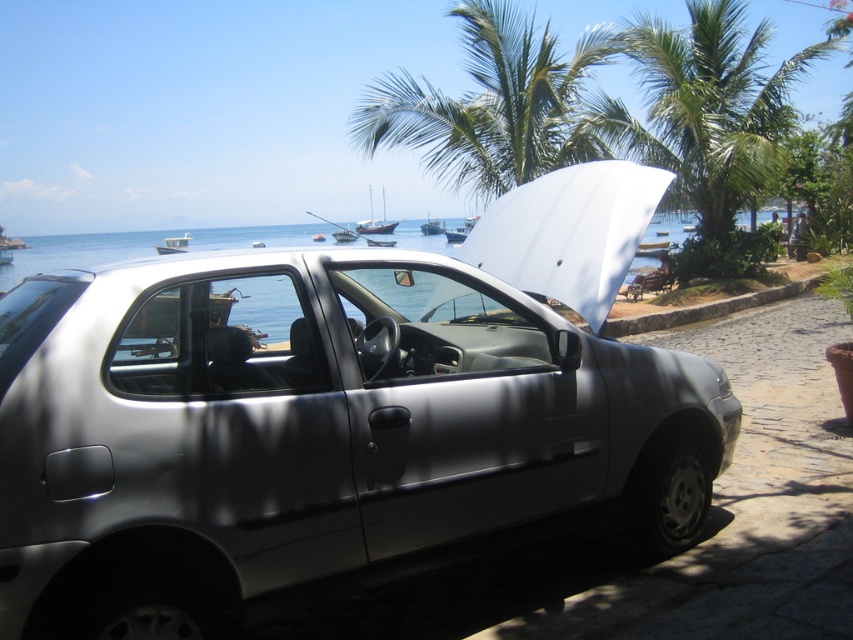
You are a photographer planning to capture a wide shot of the wooden sailboat at center and the green leafy palm tree at upper center. Based on their sizes, which object would likely occupy more of the frame horizontally?

The green leafy palm tree at upper center might be wider than the wooden sailboat at center, so it could occupy more horizontal space in the frame.

You are standing in front of the silver car with the hood open on the cobblestone street. You see two points marked on the car. Which point is closer to you, point (x=329, y=339) or point (x=430, y=220)?

Point (x=329, y=339) is closer to you than point (x=430, y=220).

You are a photographer planning to take a photo of the white glossy boat at center and the green leafy palm tree at upper right. Which object will appear closer to the camera in the final photo?

The green leafy palm tree at upper right will appear closer to the camera in the final photo because it is in front of the white glossy boat at center.